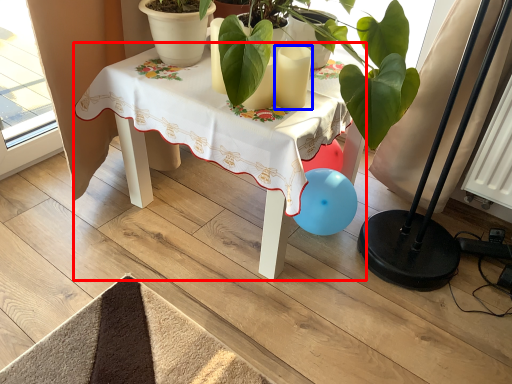
Question: Among these objects, which one is nearest to the camera, table (highlighted by a red box) or candle (highlighted by a blue box)?

Choices:
 (A) table
 (B) candle

Answer: (A)